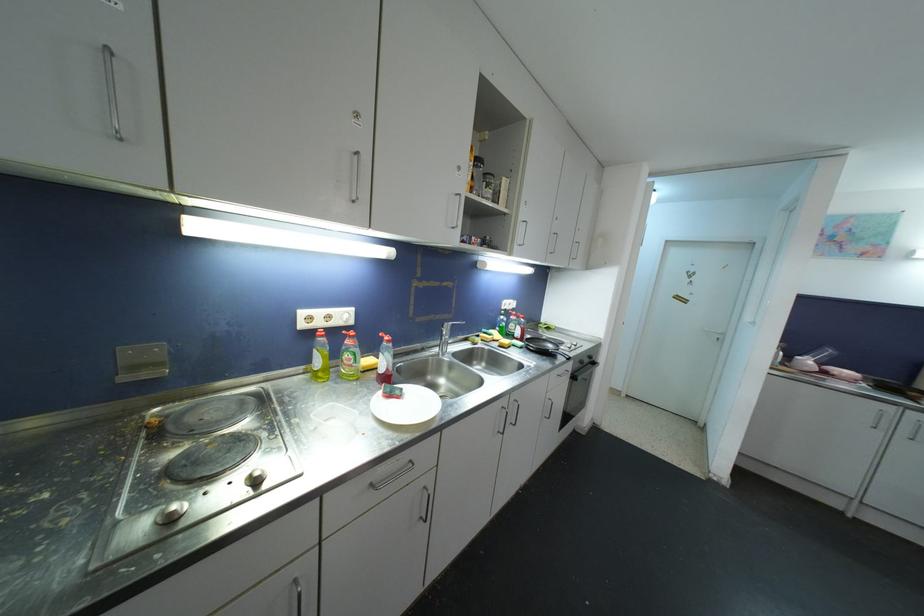
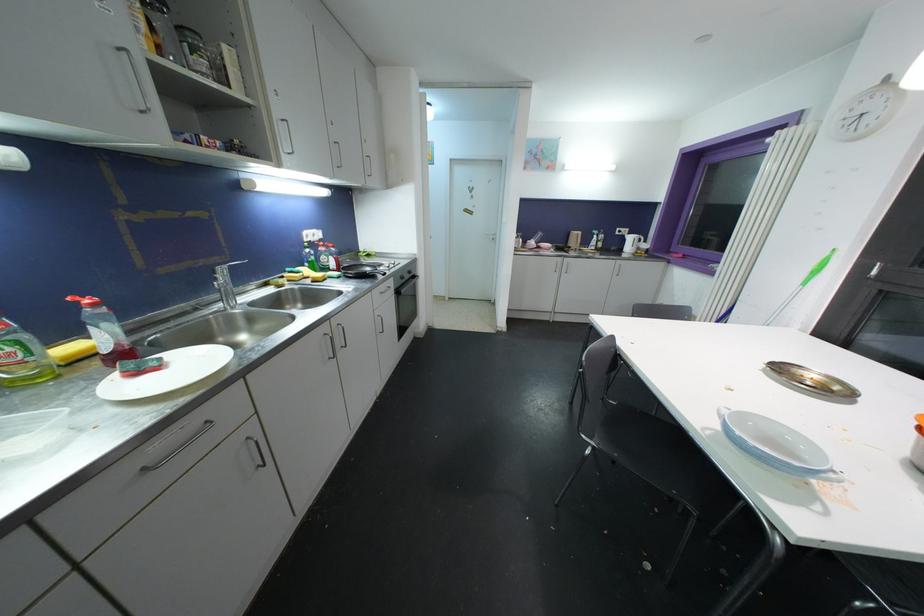
Locate, in the second image, the point that corresponds to (371,363) in the first image.

(69, 350)